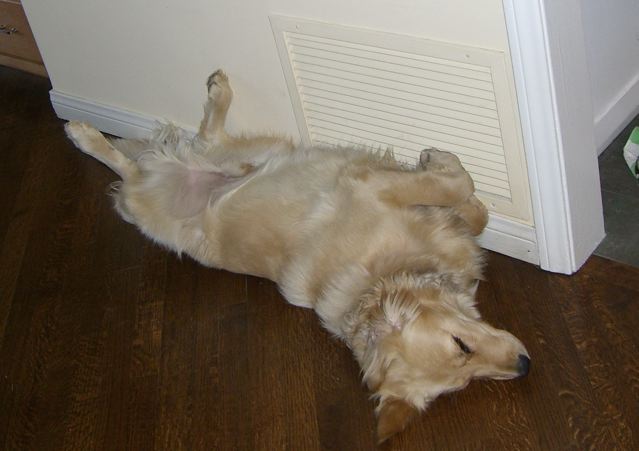
This screenshot has height=451, width=639. I want to click on vent, so click(x=439, y=99).